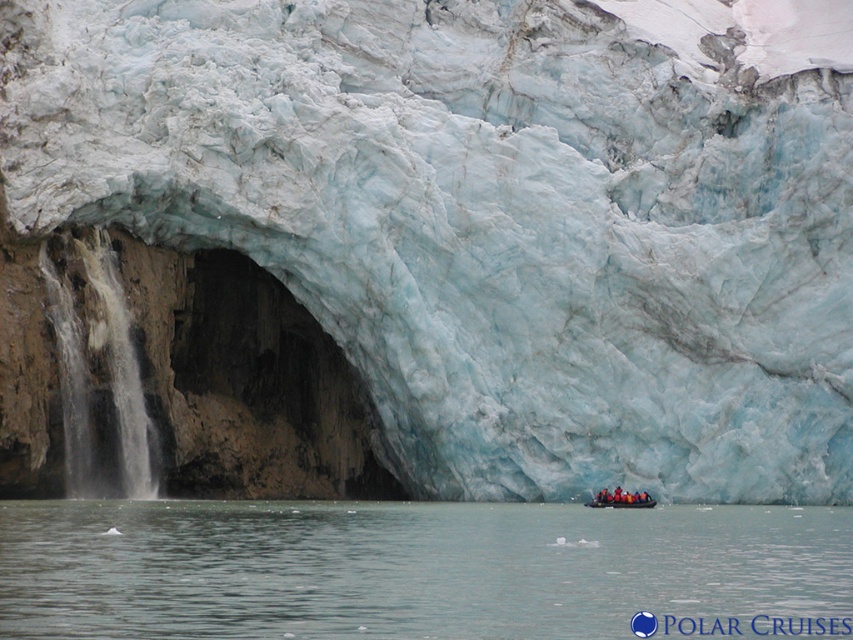
You are navigating a small inflatable boat in the glacier scene. The boat is currently at the coordinates mentioned in the description. Can you determine the direction to steer towards the clear water at lower center?

The clear water at lower center is located at point (415, 570). Since the boat is at the coordinates provided, you should steer towards the lower center direction to reach the clear water at lower center.